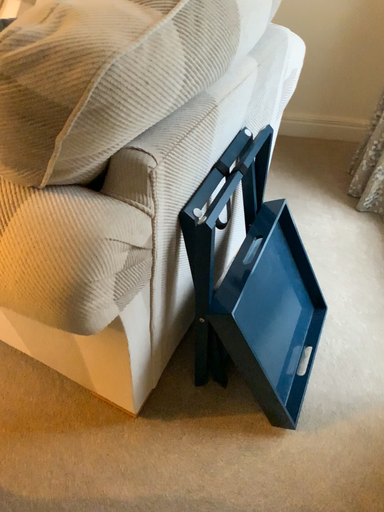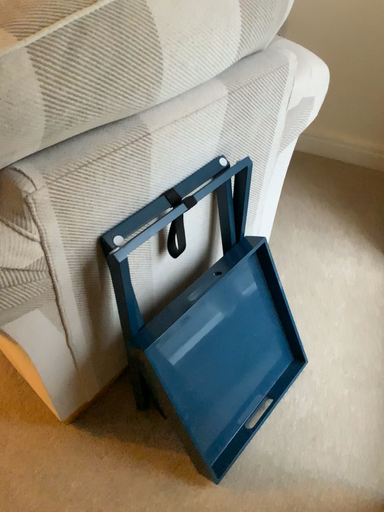
Question: Which way did the camera rotate in the video?

Choices:
 (A) rotated left
 (B) rotated right

Answer: (A)